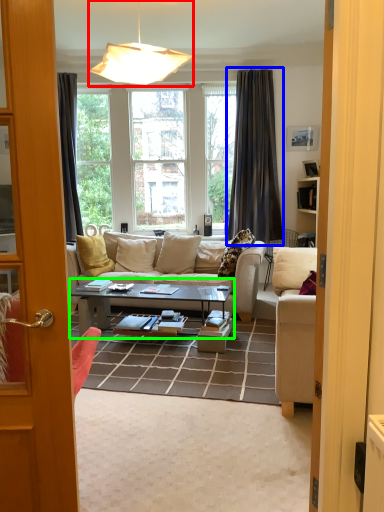
Question: Based on their relative distances, which object is farther from lamp (highlighted by a red box)? Choose from curtain (highlighted by a blue box) and coffee table (highlighted by a green box).

Choices:
 (A) curtain
 (B) coffee table

Answer: (A)